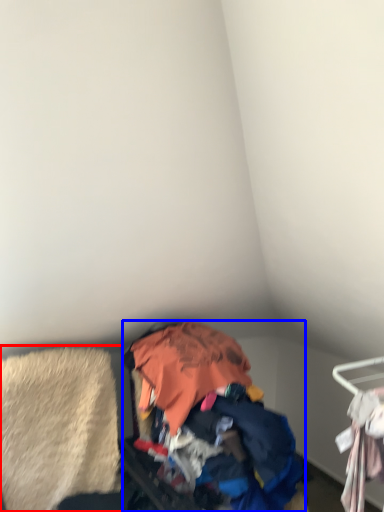
Question: Which object appears closest to the camera in this image, clothing (highlighted by a red box) or garbage (highlighted by a blue box)?

Choices:
 (A) clothing
 (B) garbage

Answer: (B)